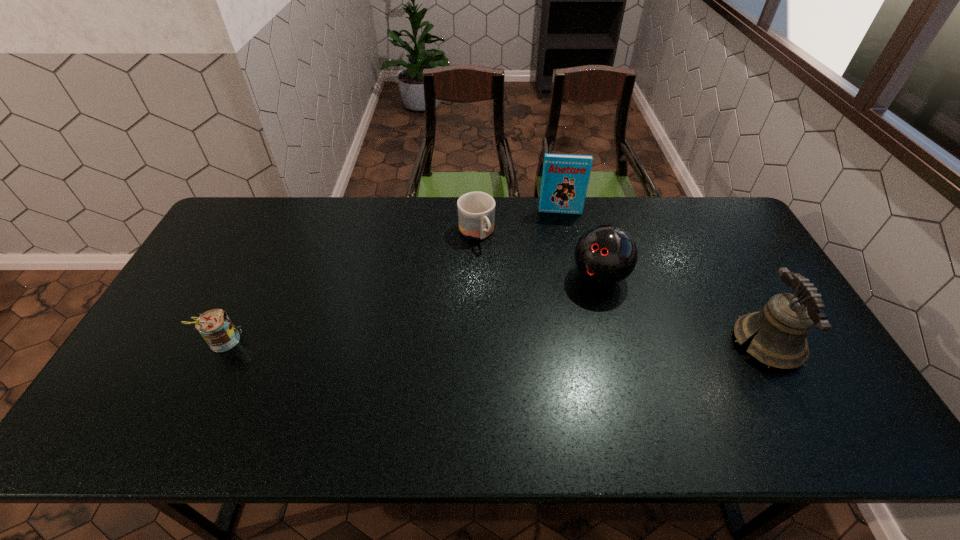
Find the location of a particular element. free area in between the mug and the bell is located at coordinates tap(622, 289).

Locate an element on the screen. This screenshot has width=960, height=540. unoccupied position between the rightmost object and the bowling ball is located at coordinates (684, 310).

Locate an element on the screen. free space between the leftmost object and the bell is located at coordinates (495, 343).

At what (x,y) coordinates should I click in order to perform the action: click on free space between the farthest object and the fourth object from right to left. Please return your answer as a coordinate pair (x, y). The image size is (960, 540). Looking at the image, I should click on (518, 222).

Where is `unoccupied area between the mug and the rightmost object`? unoccupied area between the mug and the rightmost object is located at coordinates (622, 289).

The image size is (960, 540). In order to click on vacant area that lies between the shortest object and the bowling ball in this screenshot , I will do `click(538, 255)`.

Find the location of a particular element. The image size is (960, 540). free area in between the rightmost object and the leftmost object is located at coordinates (495, 343).

The width and height of the screenshot is (960, 540). I want to click on vacant area that lies between the bell and the shortest object, so click(622, 289).

Where is `vacant space in between the book and the fourth nearest object`? The image size is (960, 540). vacant space in between the book and the fourth nearest object is located at coordinates (518, 222).

Locate an element on the screen. The width and height of the screenshot is (960, 540). vacant area that lies between the fourth nearest object and the rightmost object is located at coordinates (622, 289).